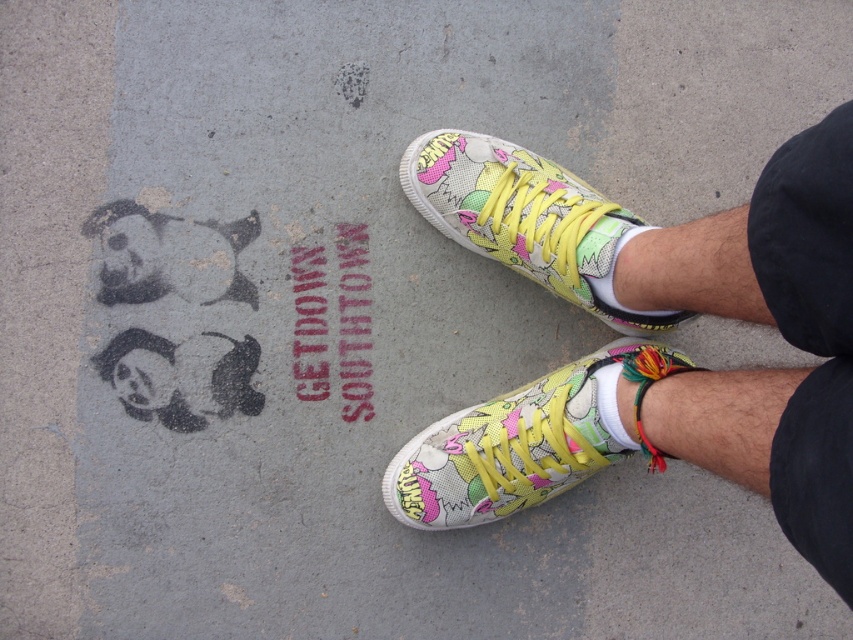
Question: Which point is farther to the camera?

Choices:
 (A) matte canvas sneakers at center
 (B) multicolored fabric sneaker at lower center
 (C) red stenciled text at center

Answer: (C)

Question: Which point is farther to the camera?

Choices:
 (A) (364, 321)
 (B) (519, 240)
 (C) (641, 449)

Answer: (A)

Question: Observing the image, what is the correct spatial positioning of multicolored fabric sneaker at center in reference to red stenciled text at center?

Choices:
 (A) below
 (B) above

Answer: (B)

Question: Does matte canvas sneakers at center have a greater width compared to red stenciled text at center?

Choices:
 (A) no
 (B) yes

Answer: (B)

Question: Which object is positioned closest to the multicolored fabric sneaker at center?

Choices:
 (A) multicolored fabric sneaker at lower center
 (B) red stenciled text at center
 (C) matte canvas sneakers at center

Answer: (C)

Question: Can you confirm if multicolored fabric sneaker at center is bigger than red stenciled text at center?

Choices:
 (A) no
 (B) yes

Answer: (B)